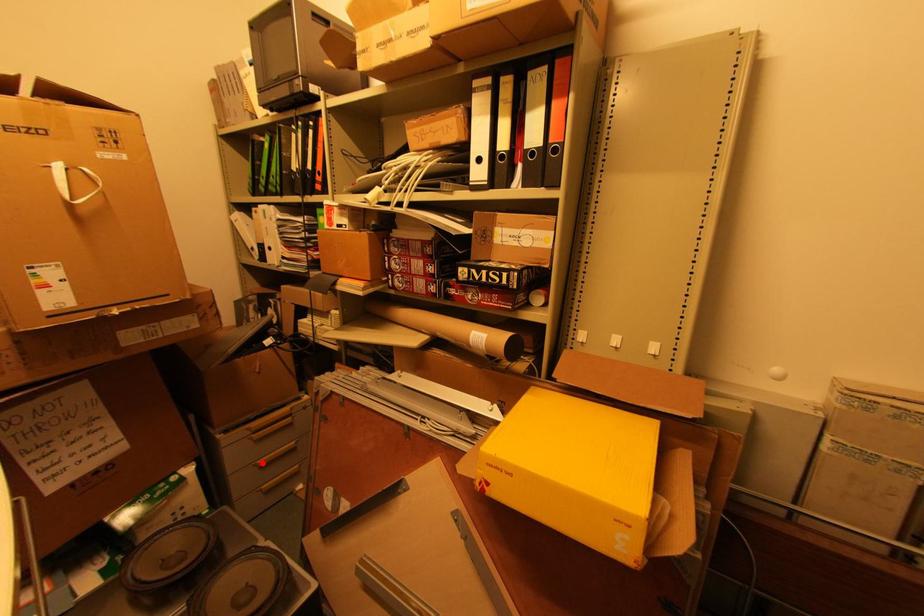
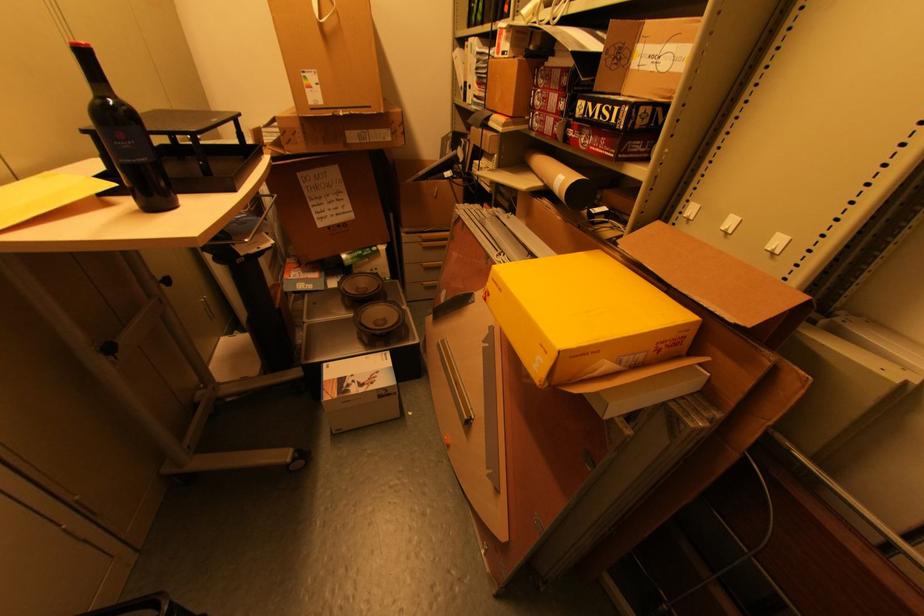
In the second image, find the point that corresponds to the highlighted location in the first image.

(428, 265)